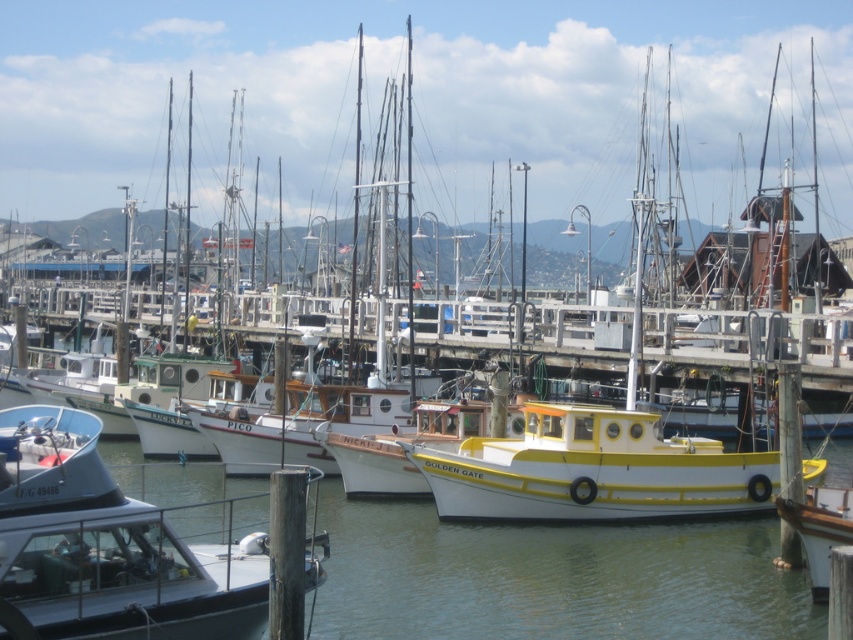
Question: Which object appears farthest from the camera in this image?

Choices:
 (A) yellow matte boat at center
 (B) matte white boat at lower left

Answer: (A)

Question: Which object is closer to the camera taking this photo?

Choices:
 (A) matte white boat at lower left
 (B) yellow matte boat at center

Answer: (A)

Question: Is matte white boat at lower left to the right of yellow matte boat at center from the viewer's perspective?

Choices:
 (A) no
 (B) yes

Answer: (A)

Question: Does matte white boat at lower left appear on the left side of yellow matte boat at center?

Choices:
 (A) no
 (B) yes

Answer: (B)

Question: Among these objects, which one is farthest from the camera?

Choices:
 (A) matte white boat at lower left
 (B) yellow matte boat at center

Answer: (B)

Question: Does matte white boat at lower left have a greater width compared to yellow matte boat at center?

Choices:
 (A) yes
 (B) no

Answer: (A)